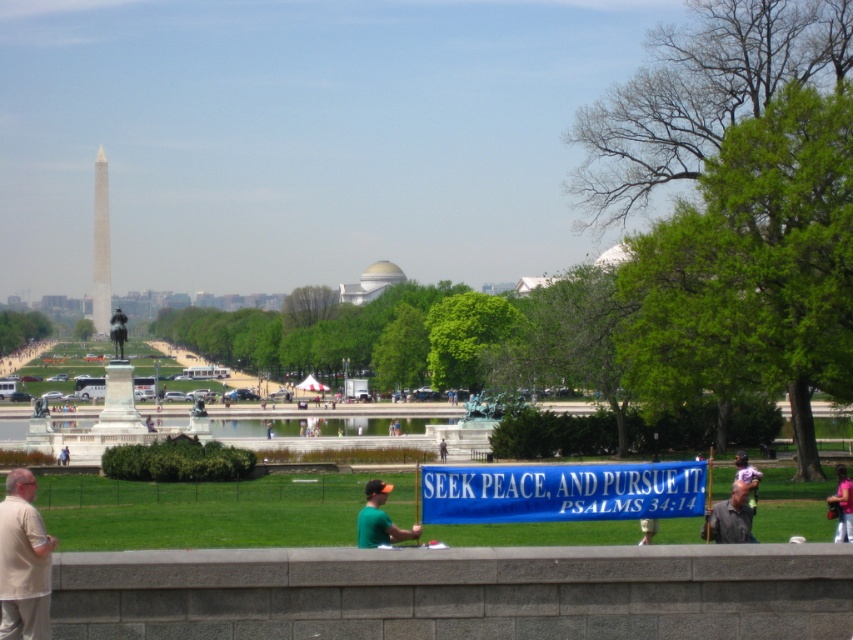
You are a photographer standing at the center of the park. You want to take a photo of the beige cotton shirt at lower left. Where should you position yourself to capture it in the frame?

The beige cotton shirt at lower left is located at point (x=22, y=561), so you should position yourself to the lower left side of the park to capture it in the frame.